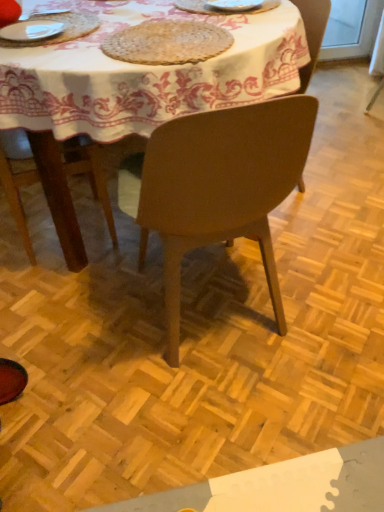
Image resolution: width=384 pixels, height=512 pixels. Find the location of `free location in front of white glossy plate at upper left`. free location in front of white glossy plate at upper left is located at coordinates (41, 51).